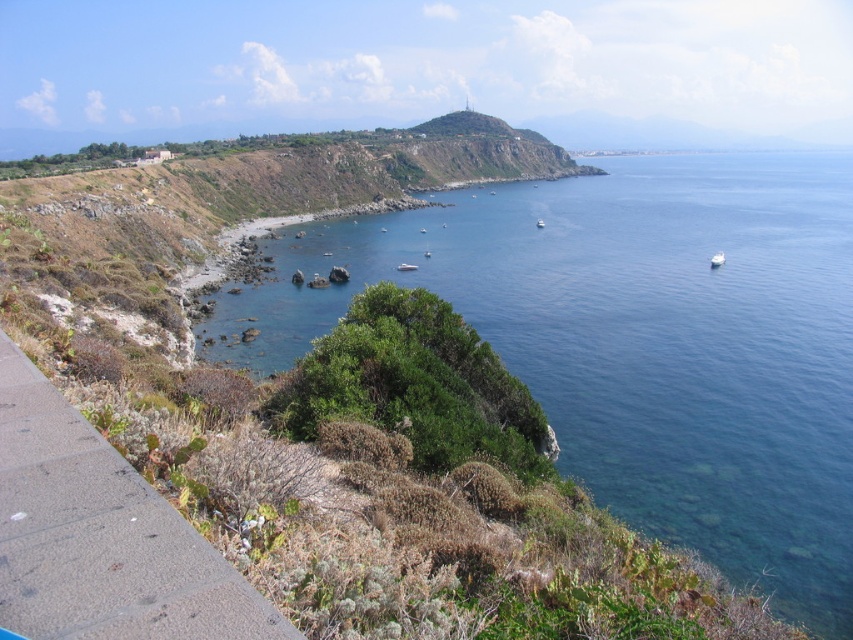
Question: Is gray concrete sidewalk at lower left above white glossy boat at lower right?

Choices:
 (A) no
 (B) yes

Answer: (A)

Question: Does white glossy boat at lower right have a larger size compared to white glossy boat at center?

Choices:
 (A) no
 (B) yes

Answer: (B)

Question: Among these points, which one is farthest from the camera?

Choices:
 (A) (751, 556)
 (B) (403, 269)
 (C) (61, 477)
 (D) (724, 257)

Answer: (D)

Question: Which point is closer to the camera?

Choices:
 (A) gray concrete sidewalk at lower left
 (B) white glossy boat at center

Answer: (A)

Question: Can you confirm if white glossy boat at lower right is thinner than white glossy boat at center?

Choices:
 (A) no
 (B) yes

Answer: (A)

Question: Which of the following is the farthest from the observer?

Choices:
 (A) (714, 264)
 (B) (219, 612)

Answer: (A)